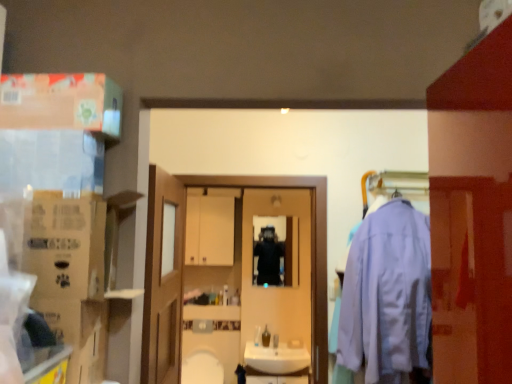
Question: Looking at their shapes, would you say black matte jacket at center is wider or thinner than white glossy sink at center?

Choices:
 (A) thin
 (B) wide

Answer: (A)

Question: Based on their positions, is black matte jacket at center located to the left or right of white glossy sink at center?

Choices:
 (A) left
 (B) right

Answer: (B)

Question: Based on their relative distances, which object is farther from the white glossy sink at center?

Choices:
 (A) white glossy mirror at center
 (B) light blue fabric sweatshirt at right
 (C) wooden door at center
 (D) matte cardboard box at upper left
 (E) brown cardboard box at left, which is the 2th cardboard box from bottom to top

Answer: (D)

Question: Estimate the real-world distances between objects in this image. Which object is farther from the matte cardboard box at upper left?

Choices:
 (A) black matte jacket at center
 (B) white matte cabinet at center
 (C) cardboard box at left, which is counted as the first cardboard box, starting from the bottom
 (D) light blue fabric sweatshirt at right
 (E) white glossy sink at center

Answer: (E)